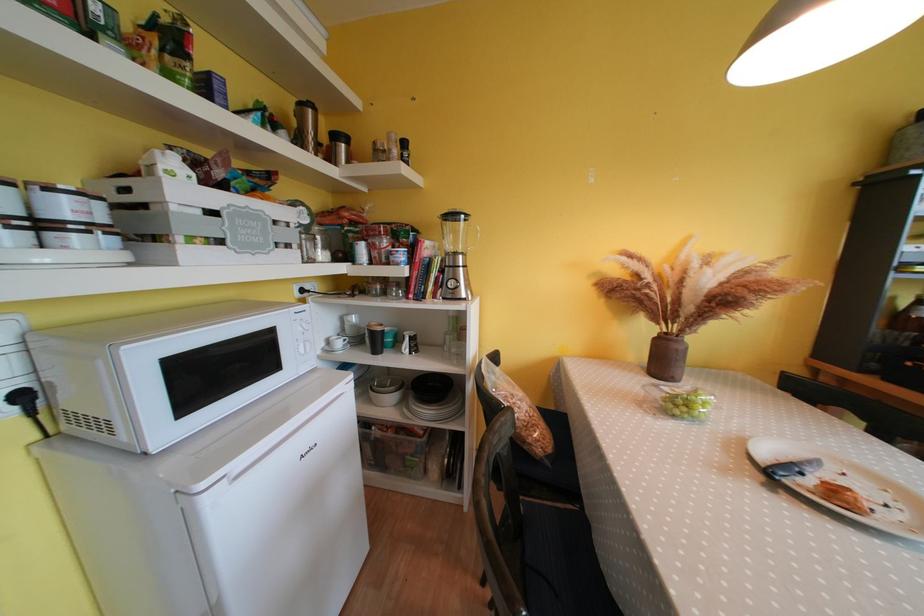
At what (x,y) coordinates should I click in order to perform the action: click on black thermos bottle. Please return your answer as a coordinate pair (x, y). This screenshot has width=924, height=616. Looking at the image, I should click on (338, 147).